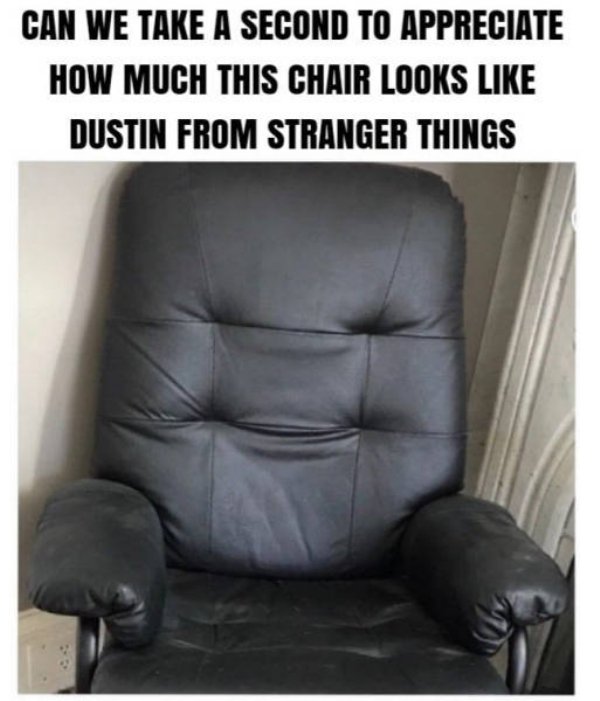
You are a GUI agent. You are given a task and a screenshot of the screen. Output one action in this format:
    pyautogui.click(x=<x>, y=<y>)
    Task: Click on the chair
    This screenshot has width=600, height=701.
    Given the screenshot: What is the action you would take?
    pyautogui.click(x=296, y=493)